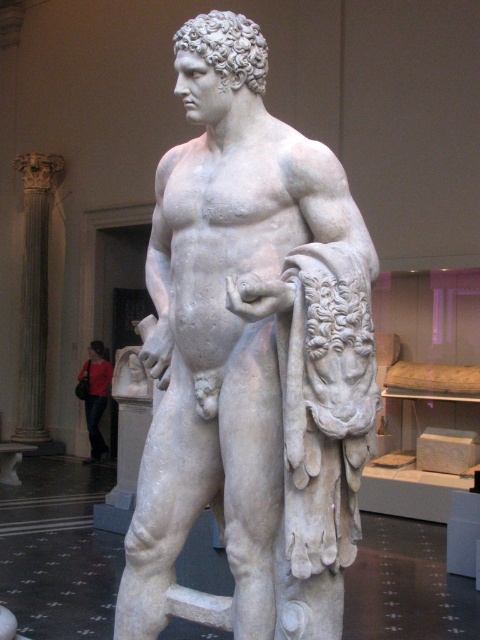
Which is more to the left, white marble statue at center or red fabric bag at lower left?

From the viewer's perspective, red fabric bag at lower left appears more on the left side.

Is point (244, 140) closer to viewer compared to point (75, 388)?

Yes.

The height and width of the screenshot is (640, 480). Find the location of `white marble statue at center`. white marble statue at center is located at coordinates (251, 358).